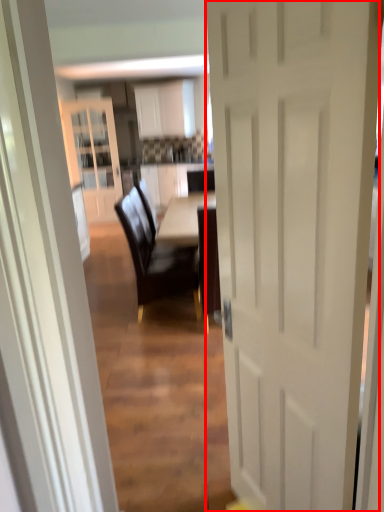
Question: From the image, what is the correct spatial relationship of door (annotated by the red box) in relation to chair?

Choices:
 (A) right
 (B) left

Answer: (A)